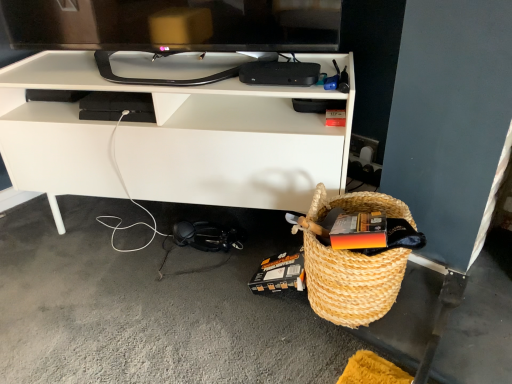
This screenshot has height=384, width=512. Identify the location of vacant space that is in between natural woven picnic basket at lower right and white matte desk at center. (179, 281).